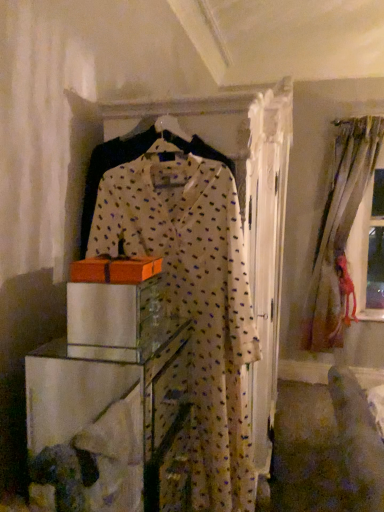
Question: Is the surface of silky beige curtains at right in direct contact with clear glass cabinet at center?

Choices:
 (A) yes
 (B) no

Answer: (B)

Question: From the image's perspective, would you say silky beige curtains at right is positioned over clear glass cabinet at center?

Choices:
 (A) yes
 (B) no

Answer: (A)

Question: From a real-world perspective, does silky beige curtains at right stand above clear glass cabinet at center?

Choices:
 (A) yes
 (B) no

Answer: (A)

Question: Is there a large distance between silky beige curtains at right and clear glass cabinet at center?

Choices:
 (A) yes
 (B) no

Answer: (A)

Question: Can you confirm if silky beige curtains at right is wider than clear glass cabinet at center?

Choices:
 (A) yes
 (B) no

Answer: (B)

Question: Considering their positions, is silky beige curtains at right located in front of or behind white dotted fabric dress at center?

Choices:
 (A) front
 (B) behind

Answer: (B)

Question: From the image's perspective, relative to white dotted fabric dress at center, is silky beige curtains at right above or below?

Choices:
 (A) below
 (B) above

Answer: (B)

Question: From a real-world perspective, relative to white dotted fabric dress at center, is silky beige curtains at right vertically above or below?

Choices:
 (A) above
 (B) below

Answer: (A)

Question: Based on their positions, is silky beige curtains at right located to the left or right of white dotted fabric dress at center?

Choices:
 (A) right
 (B) left

Answer: (A)

Question: Is point (92, 501) positioned closer to the camera than point (201, 461)?

Choices:
 (A) closer
 (B) farther

Answer: (A)

Question: From their relative heights in the image, would you say clear glass cabinet at center is taller or shorter than white dotted fabric dress at center?

Choices:
 (A) tall
 (B) short

Answer: (B)

Question: From the image's perspective, relative to white dotted fabric dress at center, is clear glass cabinet at center above or below?

Choices:
 (A) above
 (B) below

Answer: (B)

Question: Is clear glass cabinet at center inside or outside of white dotted fabric dress at center?

Choices:
 (A) inside
 (B) outside

Answer: (B)

Question: Is orange cardboard box at center inside or outside of silky beige curtains at right?

Choices:
 (A) inside
 (B) outside

Answer: (B)

Question: Is orange cardboard box at center bigger or smaller than silky beige curtains at right?

Choices:
 (A) big
 (B) small

Answer: (B)